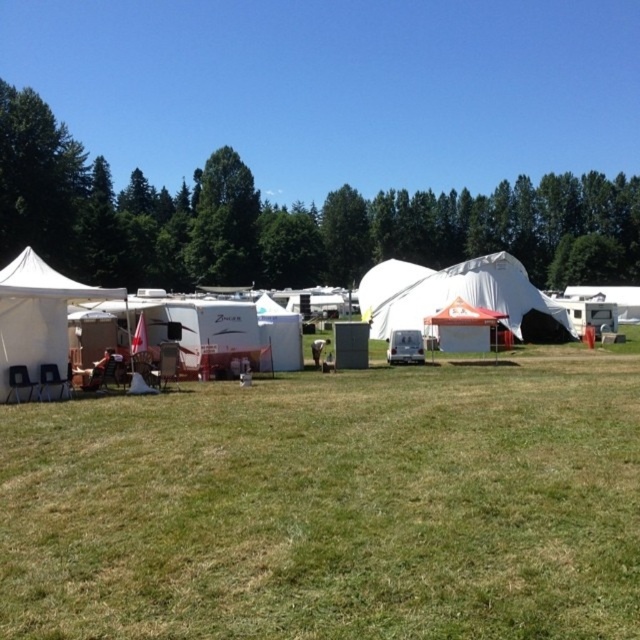
You are planning to set up a picnic table for a group. Considering the green leafy tree at upper left and the white canvas tent at center, which object would provide more shade during midday? Please explain your reasoning based on their positions and sizes.

The green leafy tree at upper left is taller than the white canvas tent at center, so it would cast a larger shadow and provide more shade during midday.

You are standing at the edge of the green grassy field at center and looking towards the white fabric tent at center. Which object is higher in the scene?

The white fabric tent at center is higher than the green grassy field at center.